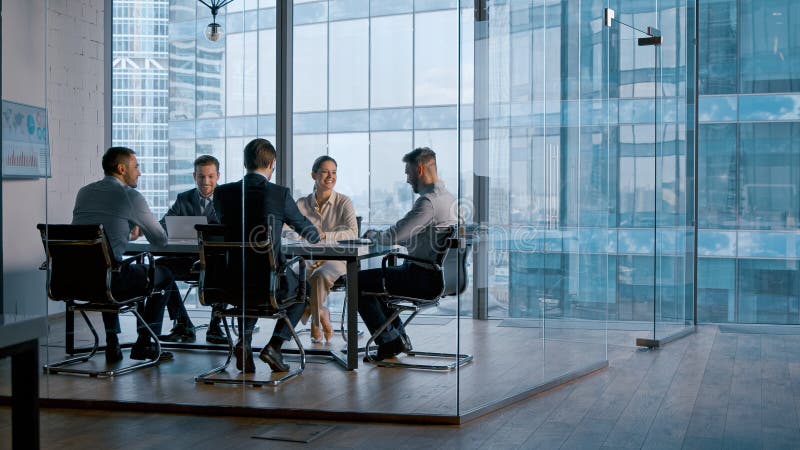
This screenshot has width=800, height=450. In order to click on office chairs in this screenshot , I will do `click(100, 290)`, `click(234, 288)`, `click(456, 287)`, `click(344, 287)`, `click(190, 280)`.